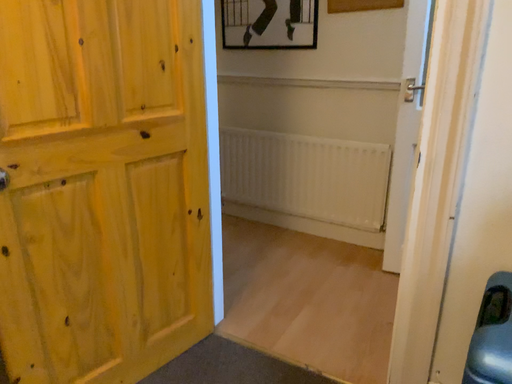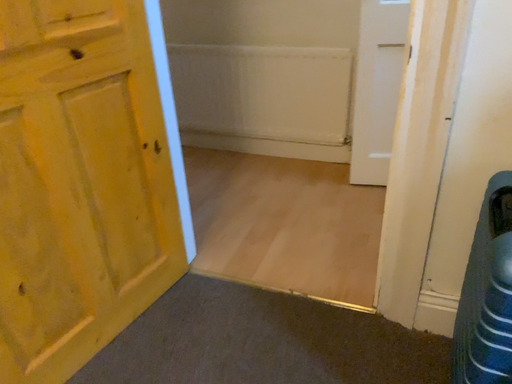
Question: How did the camera likely rotate when shooting the video?

Choices:
 (A) rotated upward
 (B) rotated downward

Answer: (B)